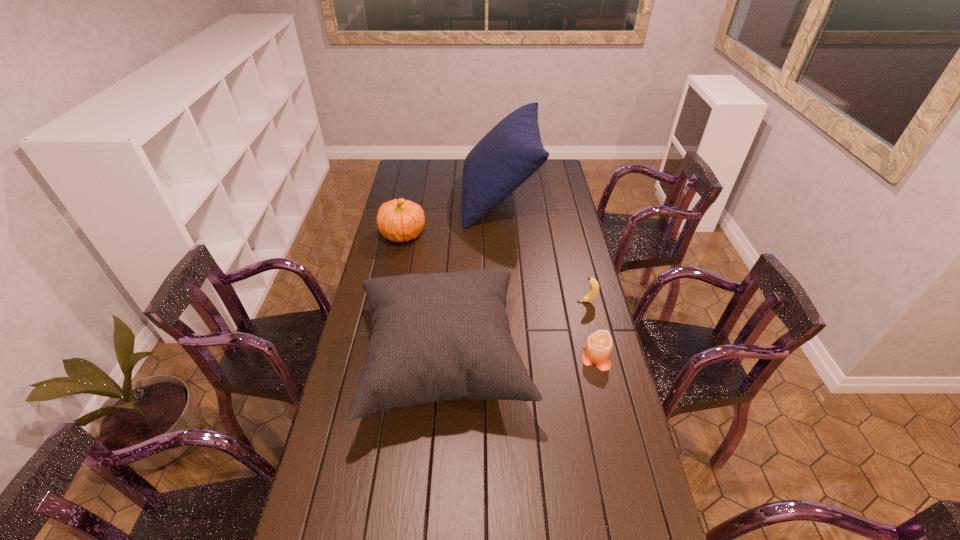
Identify the location of banana located at the right edge. (594, 285).

Where is `candle that is positioned at the right edge`? candle that is positioned at the right edge is located at coordinates (598, 347).

At what (x,y) coordinates should I click in order to perform the action: click on object that is at the far right corner. Please return your answer as a coordinate pair (x, y). Looking at the image, I should click on (512, 151).

In order to click on vacant space at the far edge of the desktop in this screenshot , I will do `click(436, 180)`.

What are the coordinates of `free space at the left edge of the desktop` in the screenshot? It's located at (327, 444).

Where is `vacant area at the right edge`? The height and width of the screenshot is (540, 960). vacant area at the right edge is located at coordinates [x=585, y=456].

Where is `unoccupied position between the banana and the tallest object`? The image size is (960, 540). unoccupied position between the banana and the tallest object is located at coordinates (543, 250).

Find the location of `unoccupied area between the candle and the banana`. unoccupied area between the candle and the banana is located at coordinates (590, 329).

Find the location of a particular element. unoccupied area between the banana and the pumpkin is located at coordinates (495, 268).

Locate an element on the screen. This screenshot has width=960, height=540. object identified as the closest to the pumpkin is located at coordinates (512, 151).